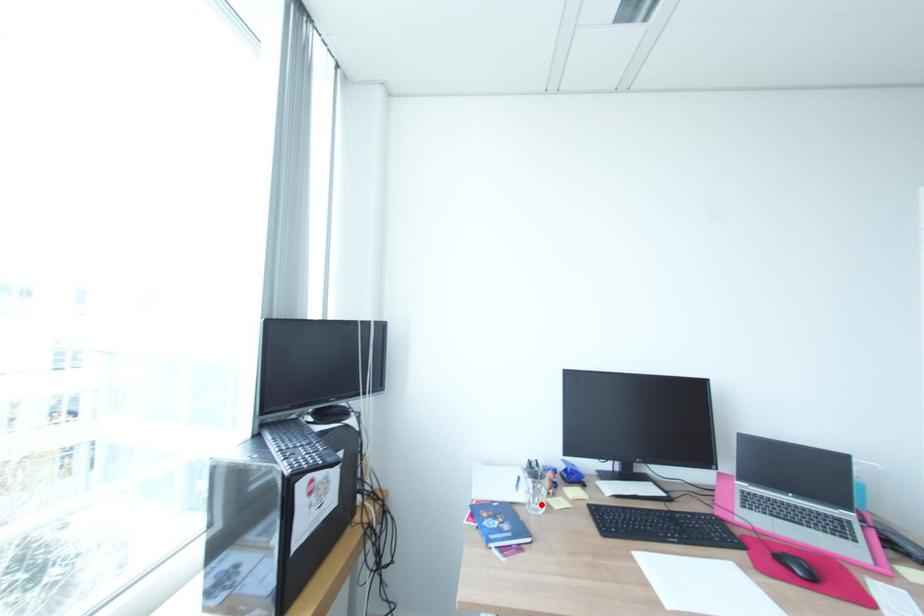
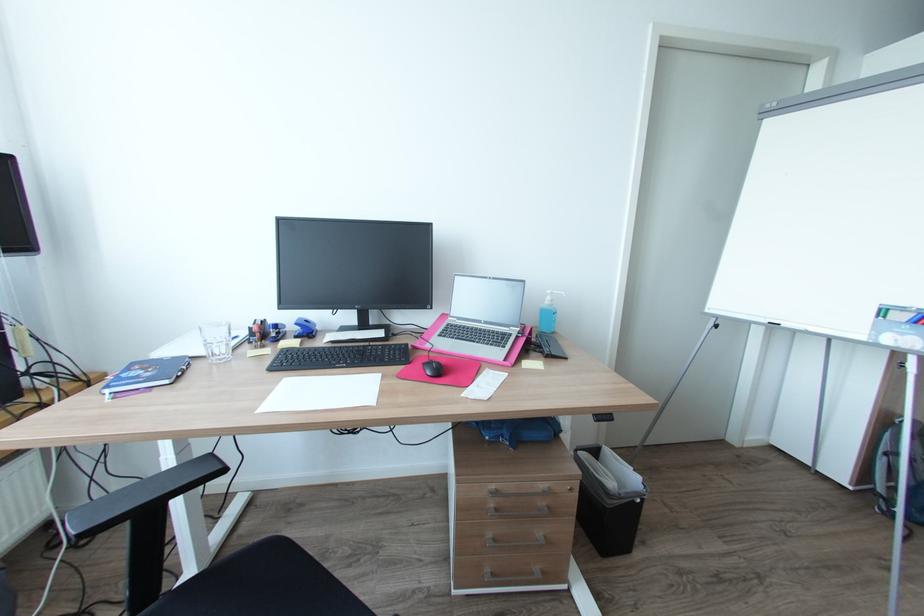
Locate, in the second image, the point that corresponds to the highlighted location in the first image.

(225, 354)